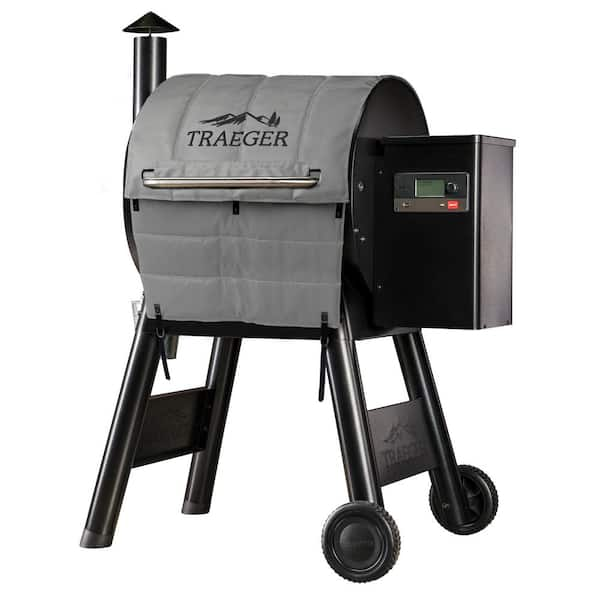
Locate an element on the screen. This screenshot has width=600, height=600. digital screen is located at coordinates (422, 193).